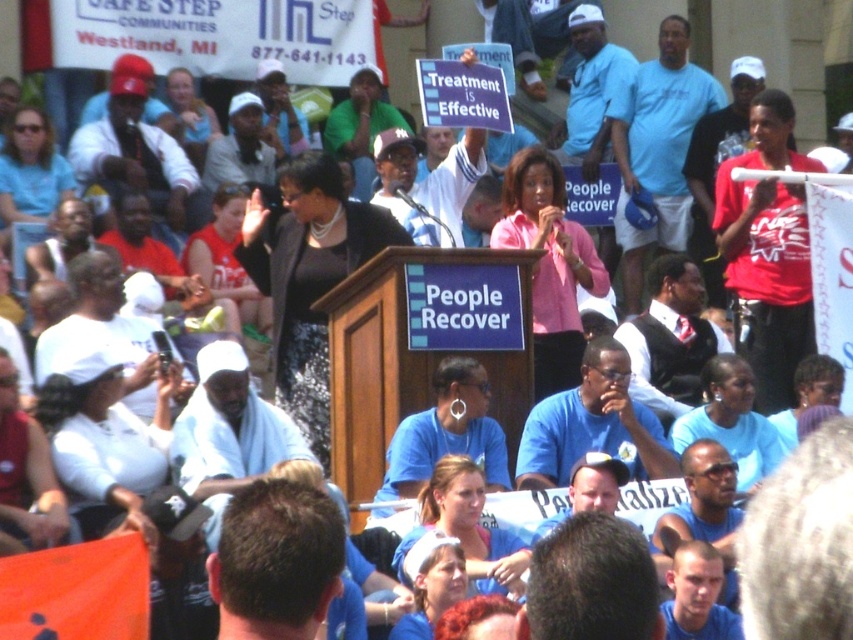
Can you confirm if white matte shirt at lower left is shorter than matte blue shirt at center?

No.

Is white matte shirt at lower left bigger than matte blue shirt at center?

Indeed, white matte shirt at lower left has a larger size compared to matte blue shirt at center.

Who is more forward, (55,460) or (451,456)?

Point (451,456) is in front.

You are a GUI agent. You are given a task and a screenshot of the screen. Output one action in this format:
    pyautogui.click(x=<x>, y=<y>)
    Task: Click on the white matte shirt at lower left
    
    Given the screenshot: What is the action you would take?
    pyautogui.click(x=103, y=436)

Who is shorter, black sequined dress at center or matte blue shirt at center?

matte blue shirt at center is shorter.

Is the position of black sequined dress at center less distant than that of matte blue shirt at center?

No, it is behind matte blue shirt at center.

Is point (334, 177) less distant than point (521, 586)?

No.

This screenshot has width=853, height=640. I want to click on black sequined dress at center, so click(308, 276).

Who is taller, black sequined dress at center or matte blue shirt at lower center?

black sequined dress at center

The height and width of the screenshot is (640, 853). What do you see at coordinates (308, 276) in the screenshot?
I see `black sequined dress at center` at bounding box center [308, 276].

Image resolution: width=853 pixels, height=640 pixels. Describe the element at coordinates (308, 276) in the screenshot. I see `black sequined dress at center` at that location.

Identify the location of black sequined dress at center. (308, 276).